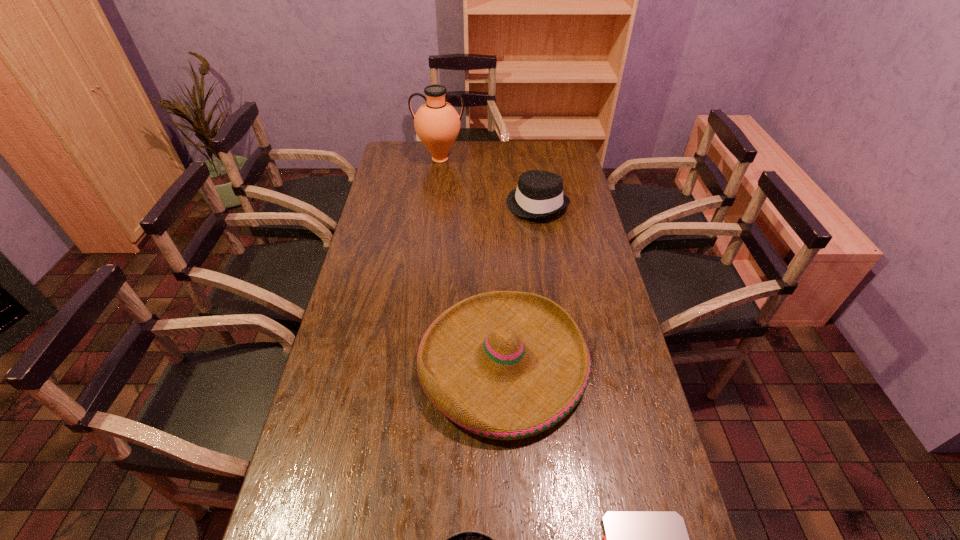
This screenshot has height=540, width=960. Find the location of `the tallest object`. the tallest object is located at coordinates (437, 123).

Where is `the farthest object`? The image size is (960, 540). the farthest object is located at coordinates (437, 123).

You are a GUI agent. You are given a task and a screenshot of the screen. Output one action in this format:
    pyautogui.click(x=<x>, y=<y>)
    Task: Click on the fedora
    
    Given the screenshot: What is the action you would take?
    [539, 194]

Where is `sombrero`? Image resolution: width=960 pixels, height=540 pixels. sombrero is located at coordinates (506, 365).

You are a GUI agent. You are given a task and a screenshot of the screen. Output one action in this format:
    pyautogui.click(x=<x>, y=<y>)
    Task: Click on the free space located on the front of the farthest object
    
    Given the screenshot: What is the action you would take?
    pyautogui.click(x=437, y=184)

Where is `vacant area located 0.130m on the back of the fourth nearest object`? This screenshot has height=540, width=960. vacant area located 0.130m on the back of the fourth nearest object is located at coordinates (532, 171).

In order to click on vacant area situated 0.070m on the back of the third farthest object in this screenshot , I will do `click(499, 285)`.

Where is `object that is positioned at the far edge`? object that is positioned at the far edge is located at coordinates click(x=437, y=123).

Where is `object that is positioned at the left edge`? This screenshot has width=960, height=540. object that is positioned at the left edge is located at coordinates (437, 123).

At what (x,y) coordinates should I click in order to perform the action: click on fedora that is at the right edge. Please return your answer as a coordinate pair (x, y). This screenshot has width=960, height=540. Looking at the image, I should click on [539, 194].